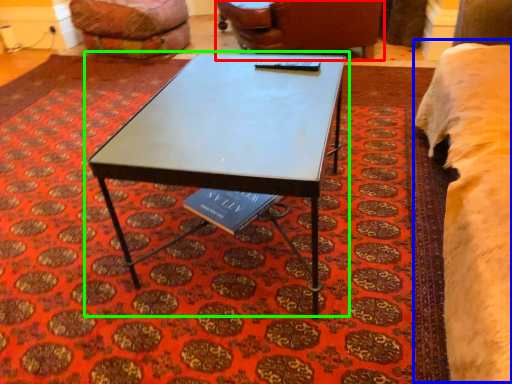
Question: Which object is the farthest from chair (highlighted by a red box)? Choose among these: bed (highlighted by a blue box) or coffee table (highlighted by a green box).

Choices:
 (A) bed
 (B) coffee table

Answer: (B)